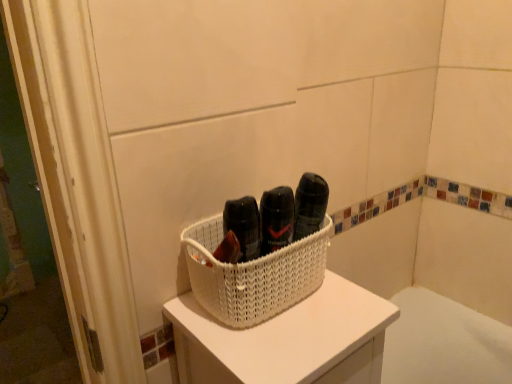
Identify the location of empty space that is ontop of white woven basket at center (from a real-world perspective). This screenshot has width=512, height=384. (292, 321).